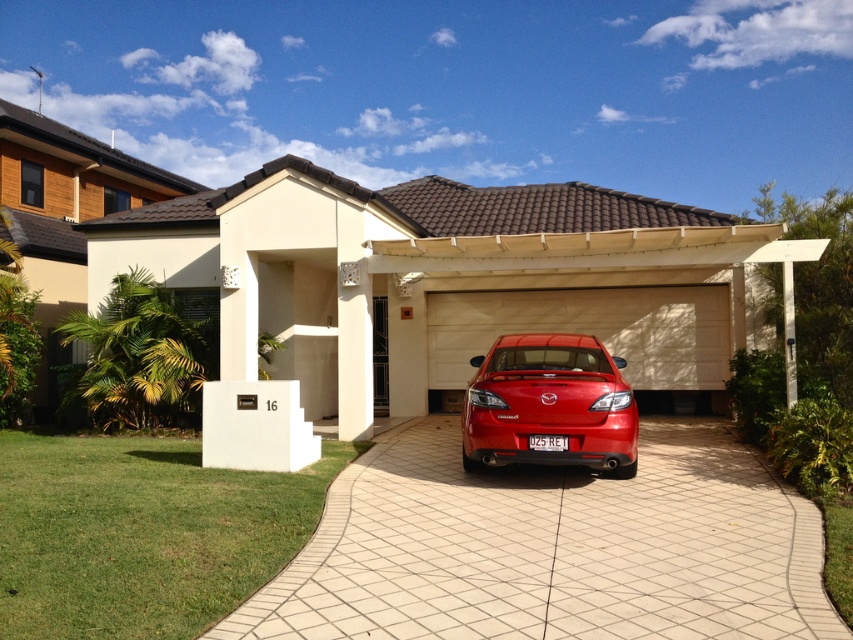
Does matte white garage at center have a smaller size compared to beige/textured garage door at center?

Incorrect, matte white garage at center is not smaller in size than beige/textured garage door at center.

Who is positioned more to the right, matte white garage at center or beige/textured garage door at center?

beige/textured garage door at center is more to the right.

The width and height of the screenshot is (853, 640). I want to click on matte white garage at center, so click(x=440, y=282).

Who is lower down, matte white garage at center or matte red car at center?

Positioned lower is matte red car at center.

In order to click on matte white garage at center in this screenshot , I will do `click(440, 282)`.

Who is higher up, beige/textured garage door at center or matte red car at center?

beige/textured garage door at center is above.

Can you confirm if beige/textured garage door at center is positioned above matte red car at center?

Correct, beige/textured garage door at center is located above matte red car at center.

Locate an element on the screen. Image resolution: width=853 pixels, height=640 pixels. beige/textured garage door at center is located at coordinates (590, 330).